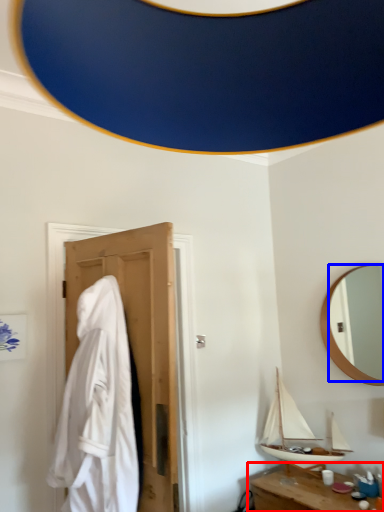
Question: Which point is closer to the camera, table (highlighted by a red box) or mirror (highlighted by a blue box)?

Choices:
 (A) table
 (B) mirror

Answer: (A)